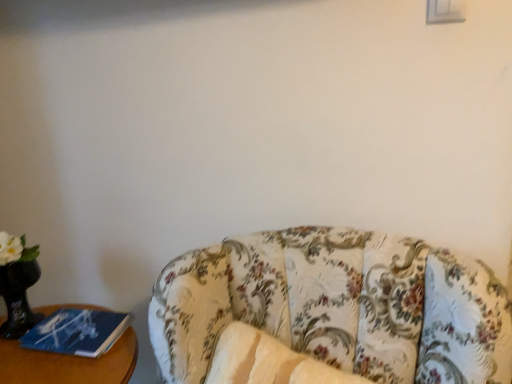
Question: From the image's perspective, is floral fabric couch at lower right above or below blue paper at left?

Choices:
 (A) above
 (B) below

Answer: (B)

Question: Looking at the image, does floral fabric couch at lower right seem bigger or smaller compared to blue paper at left?

Choices:
 (A) small
 (B) big

Answer: (B)

Question: Would you say floral fabric couch at lower right is to the left or to the right of blue paper at left in the picture?

Choices:
 (A) left
 (B) right

Answer: (B)

Question: Relative to floral fabric couch at lower right, is blue paper at left in front or behind?

Choices:
 (A) front
 (B) behind

Answer: (B)

Question: Does point (117, 360) appear closer or farther from the camera than point (385, 276)?

Choices:
 (A) closer
 (B) farther

Answer: (B)

Question: Considering the relative positions of blue paper at left and floral fabric couch at lower right in the image provided, is blue paper at left to the left or to the right of floral fabric couch at lower right?

Choices:
 (A) right
 (B) left

Answer: (B)

Question: Considering the positions of blue paper at left and floral fabric couch at lower right in the image, is blue paper at left wider or thinner than floral fabric couch at lower right?

Choices:
 (A) wide
 (B) thin

Answer: (B)